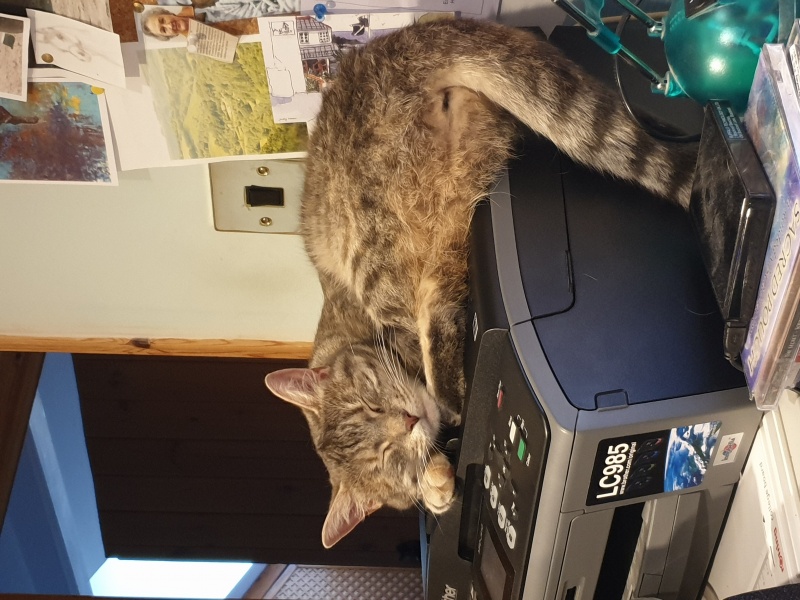
Where is `white wall plate`? This screenshot has height=600, width=800. white wall plate is located at coordinates (234, 216).